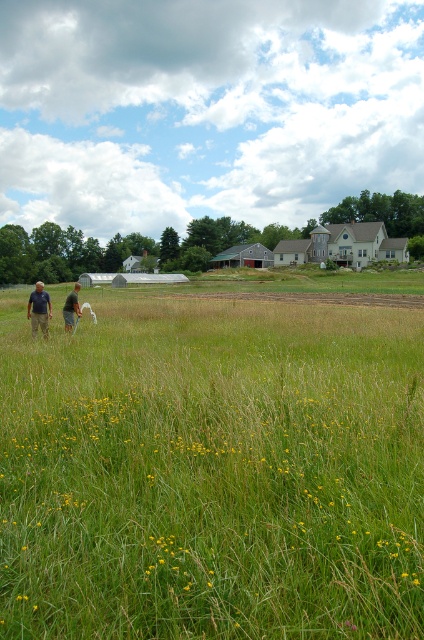
Question: Is matte black shirts at lower left below dark blue shirt at left?

Choices:
 (A) no
 (B) yes

Answer: (A)

Question: Considering the real-world distances, which object is farthest from the light brown fabric shirt at center?

Choices:
 (A) green grassy field at lower left
 (B) matte black shirts at lower left

Answer: (A)

Question: Can you confirm if dark blue shirt at left is thinner than light brown fabric shirt at center?

Choices:
 (A) no
 (B) yes

Answer: (A)

Question: Does matte black shirts at lower left appear on the right side of dark blue shirt at left?

Choices:
 (A) yes
 (B) no

Answer: (A)

Question: Which of the following is the farthest from the observer?

Choices:
 (A) (69, 324)
 (B) (78, 305)

Answer: (B)

Question: Which object is the farthest from the dark blue shirt at left?

Choices:
 (A) matte black shirts at lower left
 (B) light brown fabric shirt at center
 (C) green grassy field at lower left

Answer: (C)